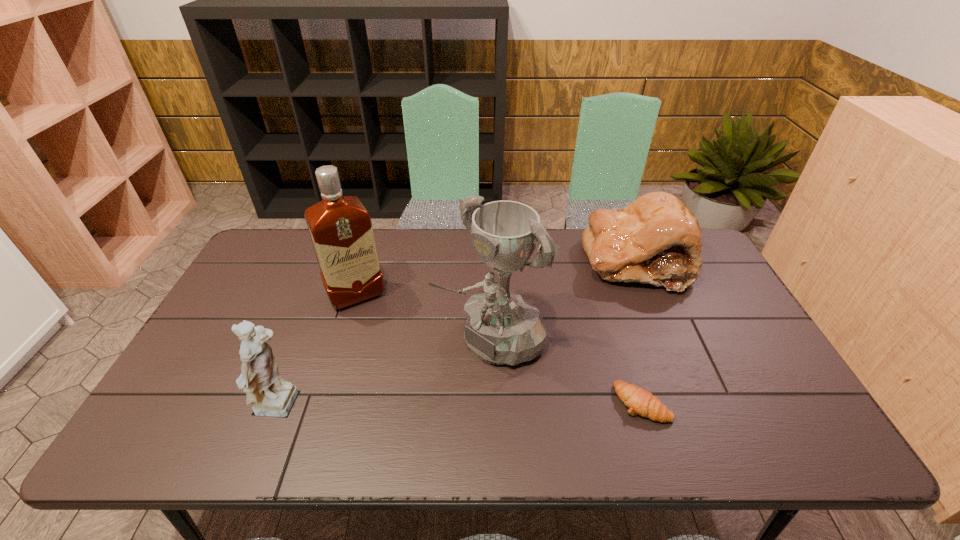
Locate an element on the screen. figurine is located at coordinates (270, 396).

Locate an element on the screen. the shortest object is located at coordinates (640, 401).

The width and height of the screenshot is (960, 540). Find the location of `bread`. bread is located at coordinates (656, 239).

Where is `the third object from left to right`? the third object from left to right is located at coordinates (503, 328).

This screenshot has width=960, height=540. I want to click on liquor, so click(340, 227).

Find the location of a particular element. free space located on the front-facing side of the figurine is located at coordinates (390, 408).

The width and height of the screenshot is (960, 540). What are the coordinates of `free space located 0.190m on the right of the crescent roll` in the screenshot? It's located at (746, 403).

This screenshot has height=540, width=960. I want to click on free spot located on the filling side of the fourth tallest object, so click(x=572, y=333).

This screenshot has height=540, width=960. Identify the location of free spot located on the filling side of the fourth tallest object. (540, 369).

Locate an element on the screen. The image size is (960, 540). vacant space located on the filling side of the fourth tallest object is located at coordinates (564, 341).